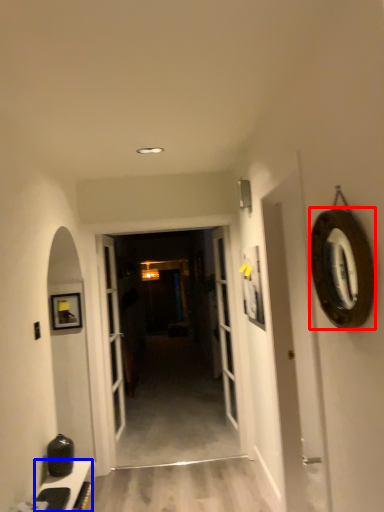
Question: Which point is closer to the camera, oval (highlighted by a red box) or cabinetry (highlighted by a blue box)?

Choices:
 (A) oval
 (B) cabinetry

Answer: (A)